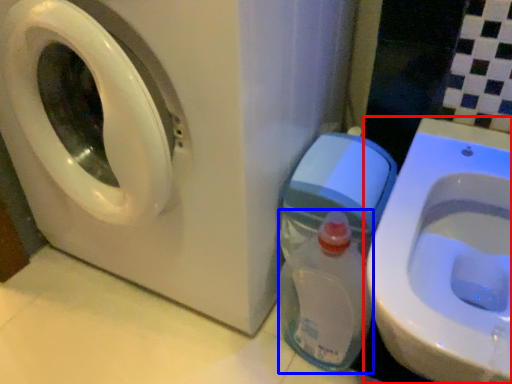
Question: Among these objects, which one is farthest to the camera, toilet (highlighted by a red box) or baby bottle (highlighted by a blue box)?

Choices:
 (A) toilet
 (B) baby bottle

Answer: (B)